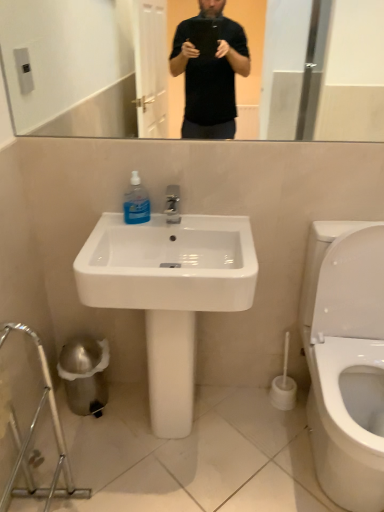
Question: From the image's perspective, is white glossy sink at center above or below white plastic toilet brush at lower right?

Choices:
 (A) below
 (B) above

Answer: (B)

Question: Is white glossy sink at center to the left or to the right of white plastic toilet brush at lower right in the image?

Choices:
 (A) right
 (B) left

Answer: (B)

Question: Estimate the real-world distances between objects in this image. Which object is closer to the blue translucent liquid at sink?

Choices:
 (A) white plastic toilet brush at lower right
 (B) white glossy sink at center

Answer: (B)

Question: Estimate the real-world distances between objects in this image. Which object is closer to the white glossy sink at center?

Choices:
 (A) blue translucent liquid at sink
 (B) white plastic toilet brush at lower right

Answer: (A)